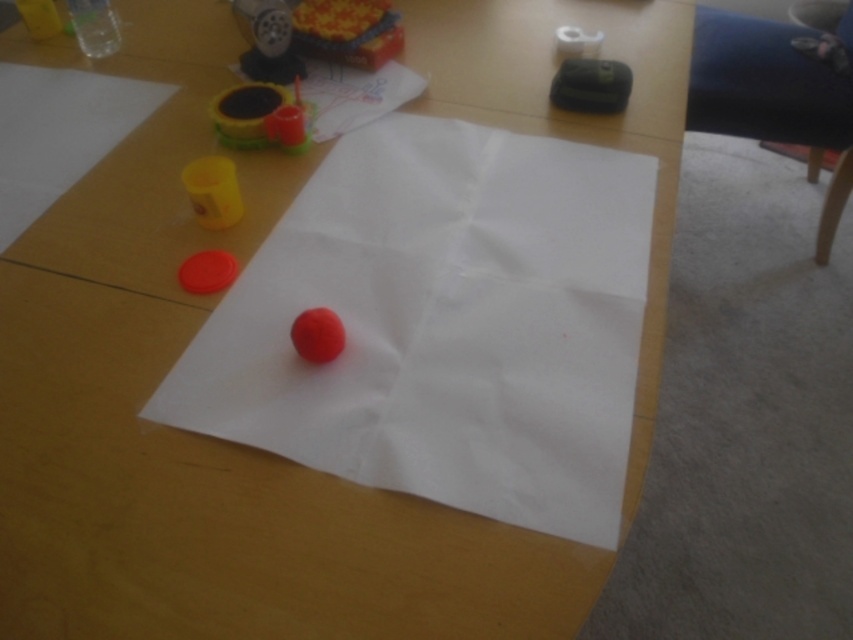
Is rubber ball at center positioned behind rubber-like red circle at center?

No, rubber ball at center is in front of rubber-like red circle at center.

Does rubber ball at center come in front of rubber-like red circle at center?

Yes, it is in front of rubber-like red circle at center.

Is point (299, 332) in front of point (194, 276)?

Yes, it is in front of point (194, 276).

The image size is (853, 640). Identify the location of rubber ball at center. (317, 333).

Looking at this image, is rubberized plastic toy at upper center below white matte toilet paper at upper center?

Yes, rubberized plastic toy at upper center is below white matte toilet paper at upper center.

Does rubberized plastic toy at upper center have a greater width compared to white matte toilet paper at upper center?

Indeed, rubberized plastic toy at upper center has a greater width compared to white matte toilet paper at upper center.

Is point (338, 10) closer to camera compared to point (596, 29)?

That is True.

Find the location of a particular element. The height and width of the screenshot is (640, 853). rubberized plastic toy at upper center is located at coordinates (347, 32).

Does rubberized plastic toy at upper center have a greater width compared to rubber ball at center?

Yes.

Can you confirm if rubberized plastic toy at upper center is positioned to the left of rubber ball at center?

Yes, rubberized plastic toy at upper center is to the left of rubber ball at center.

Between point (381, 51) and point (310, 310), which one is positioned behind?

Positioned behind is point (381, 51).

At what (x,y) coordinates should I click in order to perform the action: click on rubberized plastic toy at upper center. Please return your answer as a coordinate pair (x, y). Looking at the image, I should click on (347, 32).